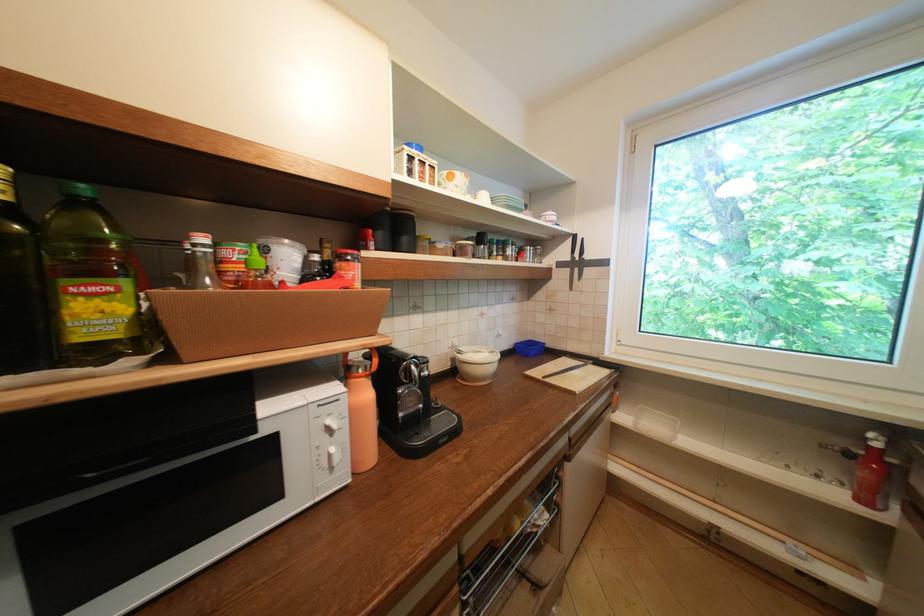
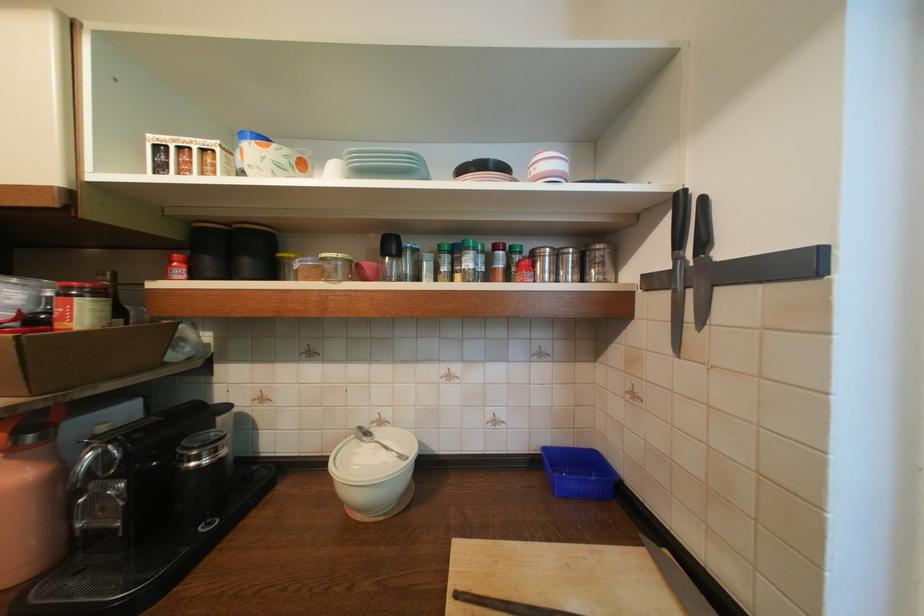
In the second image, find the point that corresponds to (358,260) in the first image.

(82, 294)